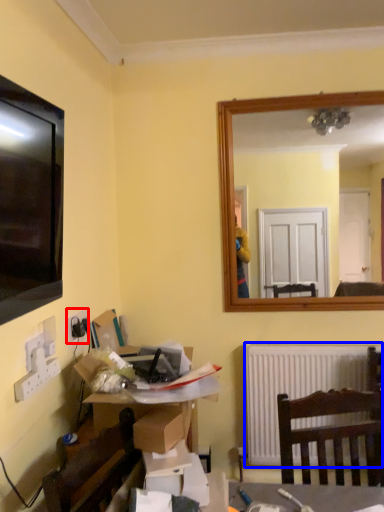
Question: Which of the following is the closest to the observer, electric outlet (highlighted by a red box) or radiator (highlighted by a blue box)?

Choices:
 (A) electric outlet
 (B) radiator

Answer: (A)